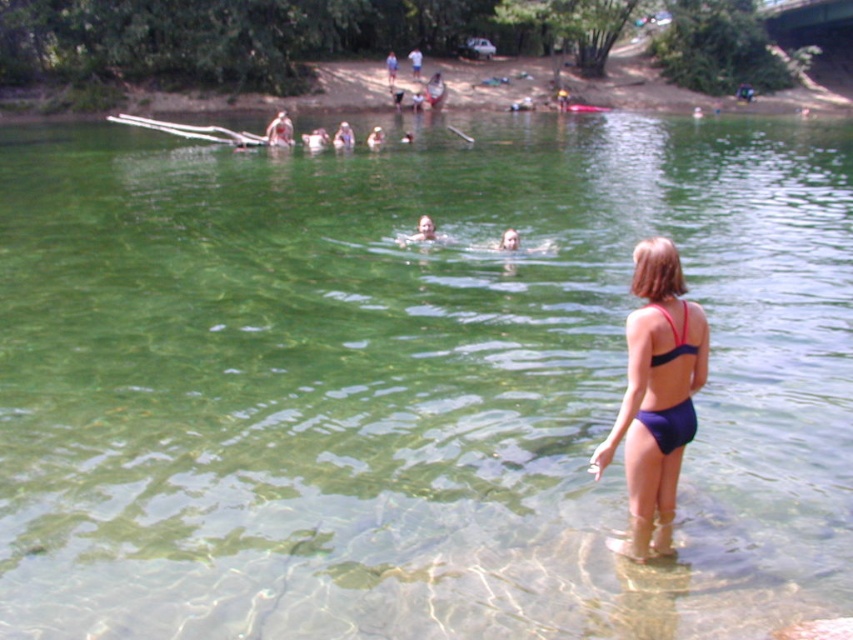
You are a photographer positioned at the edge of the swimming area. You want to take a photo that includes both the purple fabric bikini at right and the purple matte bikini at lower right. Which of the two bikinis will appear larger in your photo?

The purple fabric bikini at right appears larger in the photo because it is closer to the viewer than the purple matte bikini at lower right.

You are a photographer at the scene and want to capture the purple fabric bikini at right. Where should you aim your camera to include the point at coordinates (656, 394)?

The point at coordinates (656, 394) is located on the purple fabric bikini at right, so aim your camera at that bikini to capture the point.